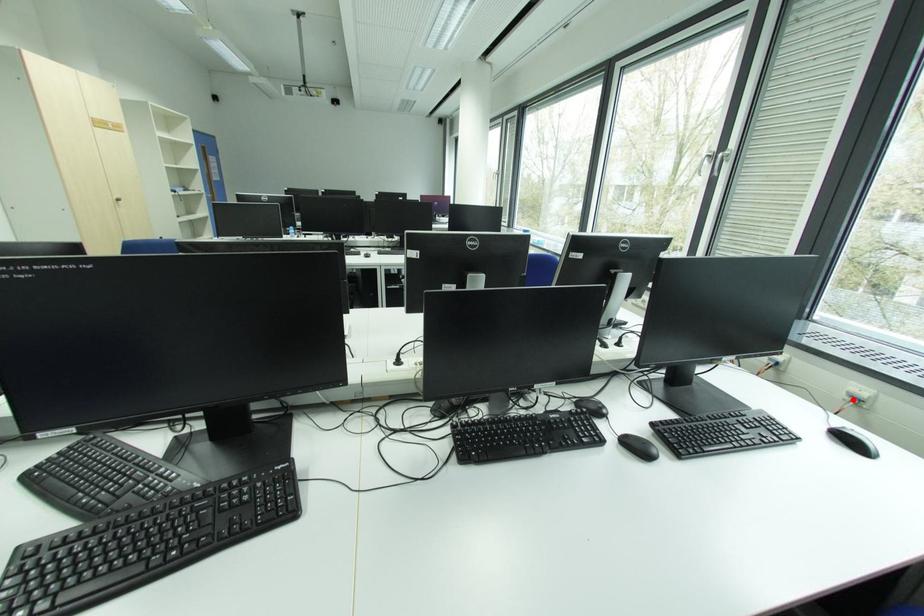
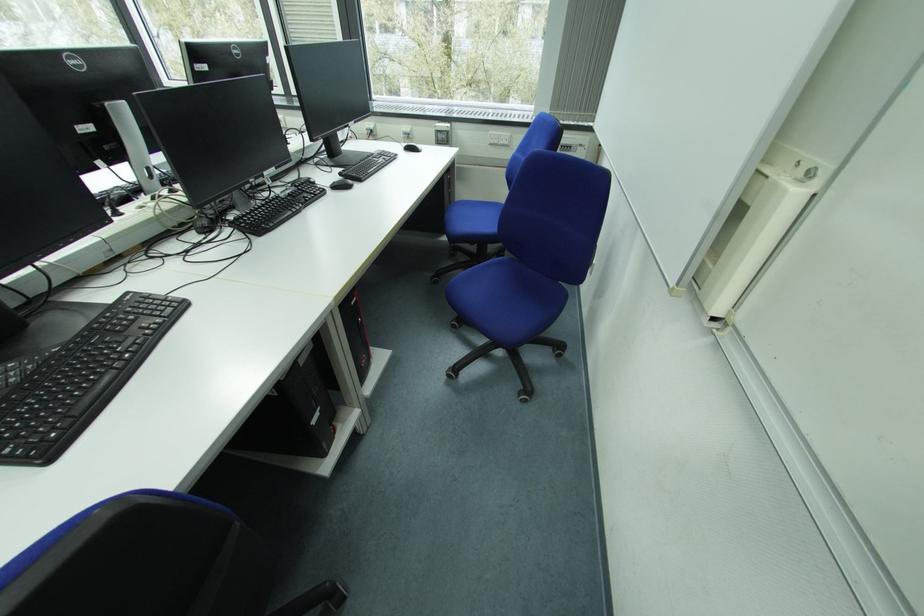
In the second image, find the point that corresponds to the highlighted location in the first image.

(409, 137)